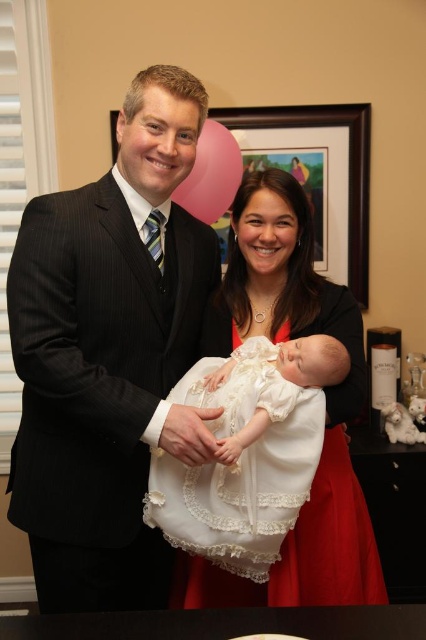
Question: Estimate the real-world distances between objects in this image. Which object is farther from the white lace dress at center?

Choices:
 (A) matte white dress at center
 (B) black pinstripe suit at left

Answer: (A)

Question: Observing the image, what is the correct spatial positioning of white lace dress at center in reference to wooden framed artwork at upper center?

Choices:
 (A) below
 (B) above

Answer: (A)

Question: Which object is closer to the camera taking this photo?

Choices:
 (A) matte white dress at center
 (B) white lace dress at center

Answer: (B)

Question: Which of the following is the farthest from the observer?

Choices:
 (A) tap(201, 493)
 (B) tap(348, 113)

Answer: (B)

Question: Does black pinstripe suit at left appear over matte white dress at center?

Choices:
 (A) yes
 (B) no

Answer: (A)

Question: Can you confirm if matte white dress at center is positioned above white lace dress at center?

Choices:
 (A) no
 (B) yes

Answer: (B)